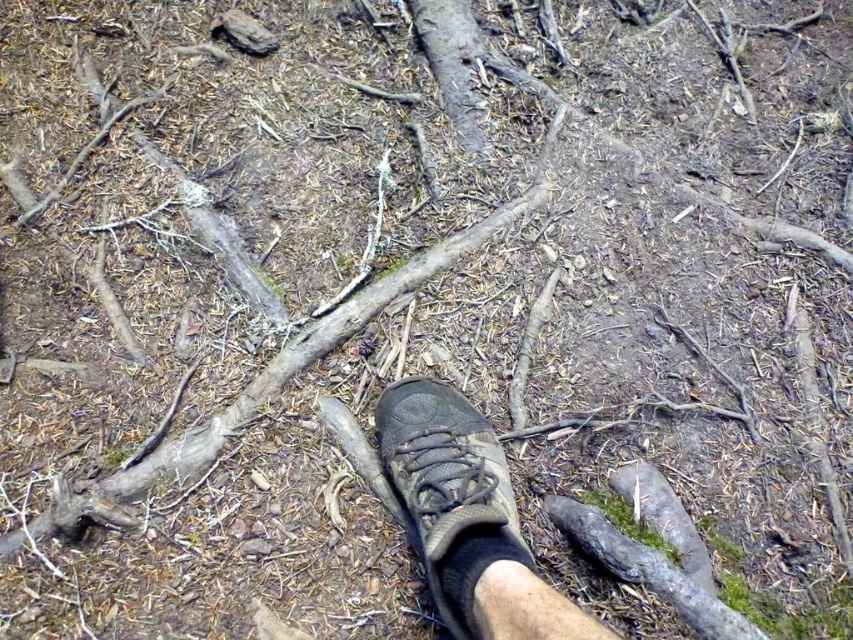
Question: In this image, where is brown suede shoe at center located relative to brown rough wood at center?

Choices:
 (A) below
 (B) above

Answer: (A)

Question: Can you confirm if brown suede shoe at center is positioned to the left of brown rough wood at center?

Choices:
 (A) yes
 (B) no

Answer: (B)

Question: Which point is closer to the camera?

Choices:
 (A) brown suede shoe at center
 (B) brown rough wood at center

Answer: (A)

Question: Which of the following is the farthest from the observer?

Choices:
 (A) (345, 314)
 (B) (450, 595)

Answer: (A)

Question: Can you confirm if brown suede shoe at center is bigger than brown rough wood at center?

Choices:
 (A) yes
 (B) no

Answer: (B)